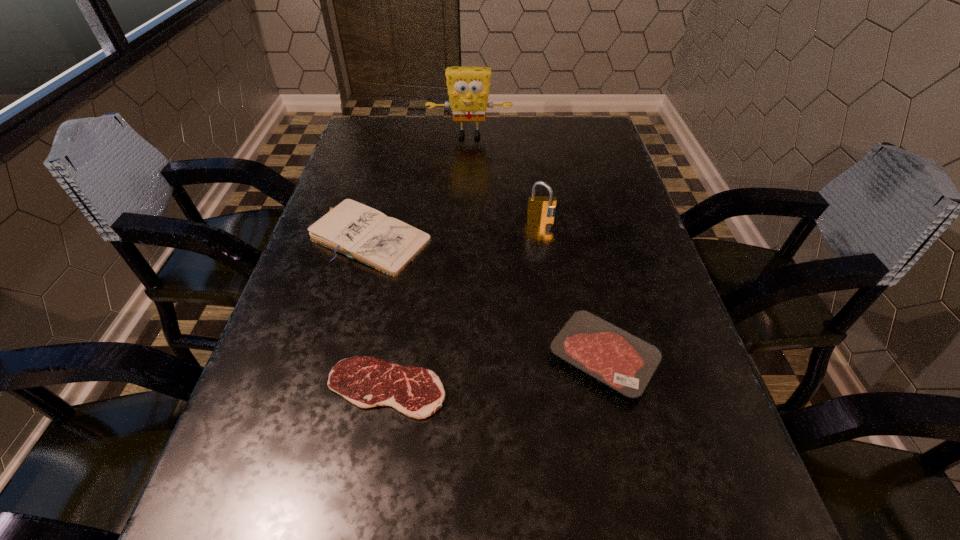
Where is `blank space located 0.380m on the back of the third tallest object`? This screenshot has width=960, height=540. blank space located 0.380m on the back of the third tallest object is located at coordinates (399, 130).

Image resolution: width=960 pixels, height=540 pixels. Identify the location of vacant space situated on the front of the right steak. (622, 442).

Find the location of a particular element. free location located 0.240m on the right of the shorter steak is located at coordinates (590, 388).

I want to click on object that is at the far edge, so click(x=468, y=87).

The image size is (960, 540). I want to click on notebook situated at the left edge, so click(x=387, y=244).

You are a GUI agent. You are given a task and a screenshot of the screen. Output one action in this format:
    pyautogui.click(x=<x>, y=<y>)
    Task: Click on the steak positioned at the left edge
    
    Given the screenshot: What is the action you would take?
    (x=417, y=392)

Locate an element on the screen. object that is at the right edge is located at coordinates (626, 363).

You are a GUI agent. You are given a task and a screenshot of the screen. Output one action in this format:
    pyautogui.click(x=<x>, y=<y>)
    Task: Click on the vacant space at the far edge of the desktop
    Image resolution: width=960 pixels, height=540 pixels.
    Given the screenshot: What is the action you would take?
    (523, 128)

In the image, there is a desktop. Identify the location of vacant space at the left edge. (313, 536).

Locate an element on the screen. Image resolution: width=960 pixels, height=540 pixels. free region at the right edge is located at coordinates (704, 404).